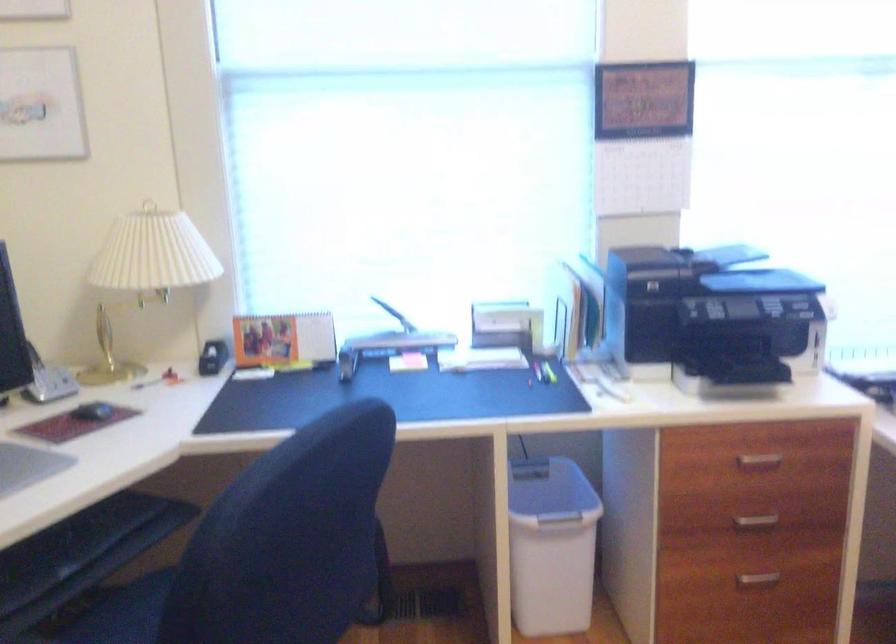
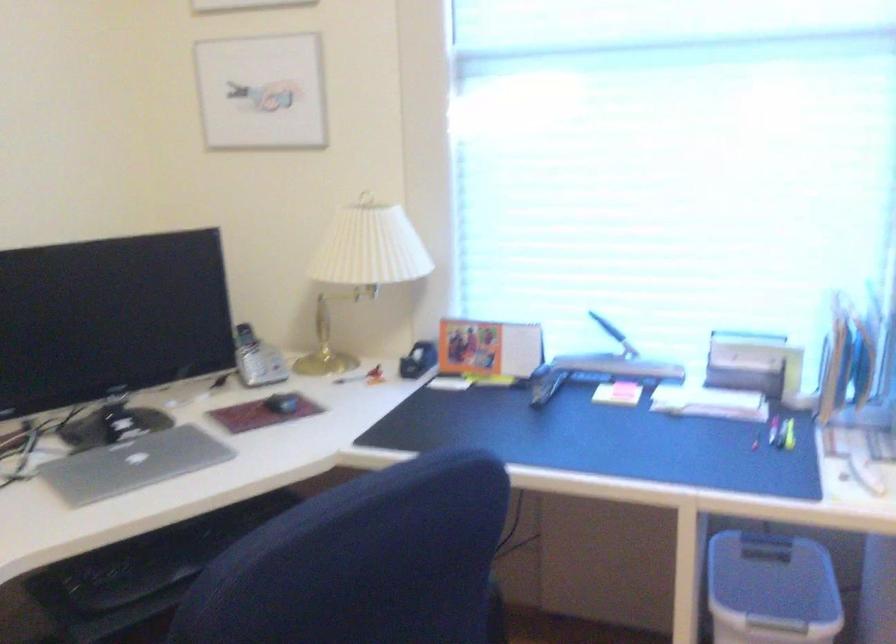
Where in the second image is the point corresponding to [211,357] from the first image?

(418, 360)